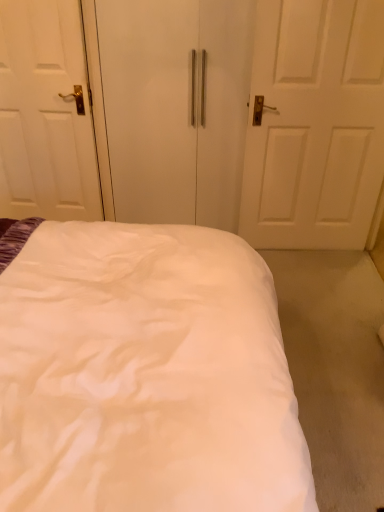
Measure the distance between white glossy door at left and camera.

The depth of white glossy door at left is 6.58 feet.

Where is `white matte wardrobe at center`? The image size is (384, 512). white matte wardrobe at center is located at coordinates (176, 106).

Which of these two, white glossy door at left or white fabric bed at center, stands taller?

white glossy door at left is taller.

Is white glossy door at left to the left or to the right of white fabric bed at center in the image?

Based on their positions, white glossy door at left is located to the left of white fabric bed at center.

Is white glossy door at left in front of or behind white fabric bed at center in the image?

In the image, white glossy door at left appears behind white fabric bed at center.

Does white glossy door at left turn towards white fabric bed at center?

No, white glossy door at left is not turned towards white fabric bed at center.

Relative to white glossy door at left, is white fabric bed at center in front or behind?

white fabric bed at center is positioned closer to the viewer than white glossy door at left.

Does white fabric bed at center touch white glossy door at left?

white fabric bed at center and white glossy door at left are clearly separated.

From a real-world perspective, is white fabric bed at center beneath white glossy door at left?

Correct, in the physical world, white fabric bed at center is lower than white glossy door at left.

Can you confirm if white fabric bed at center is thinner than white glossy door at left?

No.

Considering the sizes of objects white glossy door at left and white matte wardrobe at center in the image provided, who is taller, white glossy door at left or white matte wardrobe at center?

Standing taller between the two is white matte wardrobe at center.

From a real-world perspective, which is physically above, white glossy door at left or white matte wardrobe at center?

From a 3D spatial view, white glossy door at left is above.

Considering the relative sizes of white glossy door at left and white matte wardrobe at center in the image provided, is white glossy door at left wider than white matte wardrobe at center?

Indeed, white glossy door at left has a greater width compared to white matte wardrobe at center.

Who is shorter, white fabric bed at center or white matte wardrobe at center?

white fabric bed at center is shorter.

Considering the sizes of white fabric bed at center and white matte wardrobe at center in the image, is white fabric bed at center bigger or smaller than white matte wardrobe at center?

Clearly, white fabric bed at center is larger in size than white matte wardrobe at center.

From a real-world perspective, is white fabric bed at center located higher than white matte wardrobe at center?

No, from a real-world perspective, white fabric bed at center is not on top of white matte wardrobe at center.

In the image, is white fabric bed at center positioned in front of or behind white matte wardrobe at center?

Clearly, white fabric bed at center is in front of white matte wardrobe at center.

Find the location of a particular element. This screenshot has width=384, height=512. bed directly beneath the white matte wardrobe at center (from a real-world perspective) is located at coordinates (145, 375).

From the image's perspective, is white matte wardrobe at center located above or below white fabric bed at center?

white matte wardrobe at center is situated higher than white fabric bed at center in the image.

Looking at this image, from a real-world perspective, is white matte wardrobe at center located beneath white fabric bed at center?

No.

Looking at this image, considering the sizes of objects white matte wardrobe at center and white glossy door at left in the image provided, who is smaller, white matte wardrobe at center or white glossy door at left?

white glossy door at left.

Which object is more forward, white matte wardrobe at center or white glossy door at left?

white matte wardrobe at center is in front.

Measure the distance between white matte wardrobe at center and white glossy door at left.

The distance of white matte wardrobe at center from white glossy door at left is 16.09 inches.

Consider the image. Does white matte wardrobe at center appear on the left side of white glossy door at left?

No, white matte wardrobe at center is not to the left of white glossy door at left.

Locate an element on the screen. door on the left of white fabric bed at center is located at coordinates (45, 114).

In order to click on bed that appears in front of the white glossy door at left in this screenshot , I will do `click(145, 375)`.

When comparing their distances from white fabric bed at center, does white matte wardrobe at center or white glossy door at left seem further?

Based on the image, white glossy door at left appears to be further to white fabric bed at center.

When comparing their distances from white matte wardrobe at center, does white fabric bed at center or white glossy door at left seem closer?

white glossy door at left.

Looking at the image, which one is located further to white glossy door at left, white matte wardrobe at center or white fabric bed at center?

white fabric bed at center is further to white glossy door at left.

Looking at the image, which one is located further to white glossy door at left, white fabric bed at center or white matte wardrobe at center?

The object further to white glossy door at left is white fabric bed at center.

From the image, which object appears to be nearer to white matte wardrobe at center, white glossy door at left or white fabric bed at center?

Among the two, white glossy door at left is located nearer to white matte wardrobe at center.

From the image, which object appears to be farther from white fabric bed at center, white glossy door at left or white matte wardrobe at center?

Among the two, white glossy door at left is located further to white fabric bed at center.

The height and width of the screenshot is (512, 384). Find the location of `screen door between white fabric bed at center and white glossy door at left in the front-back direction`. screen door between white fabric bed at center and white glossy door at left in the front-back direction is located at coordinates (176, 106).